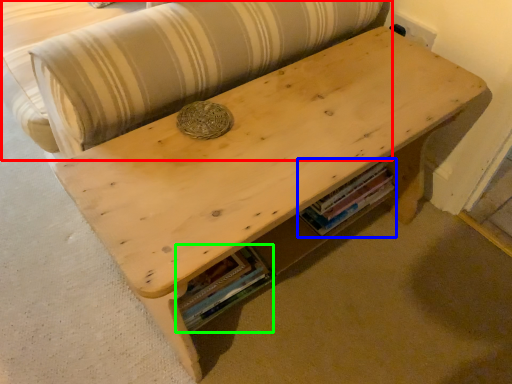
Question: Which is farther away from couch (highlighted by a red box)? book (highlighted by a blue box) or book (highlighted by a green box)?

Choices:
 (A) book
 (B) book

Answer: (A)